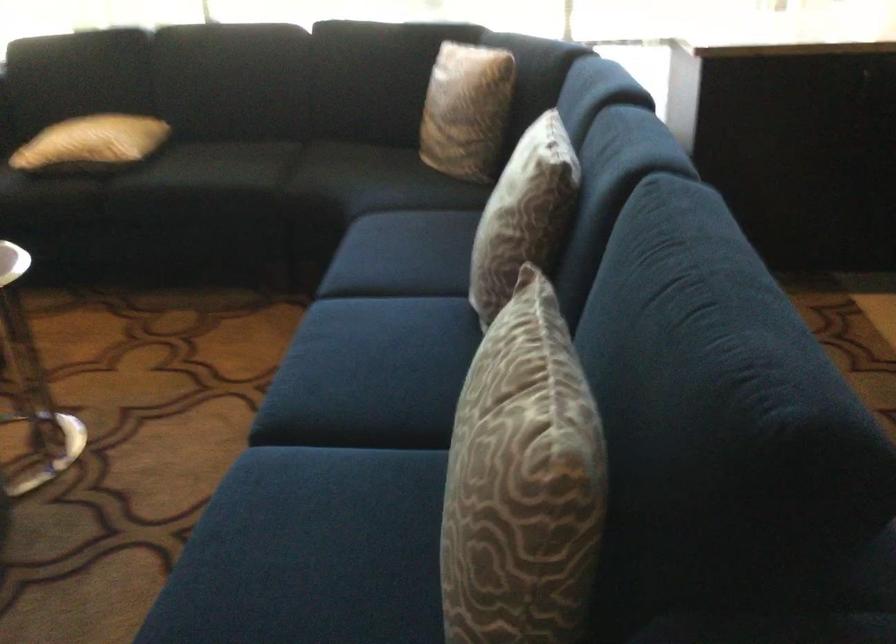
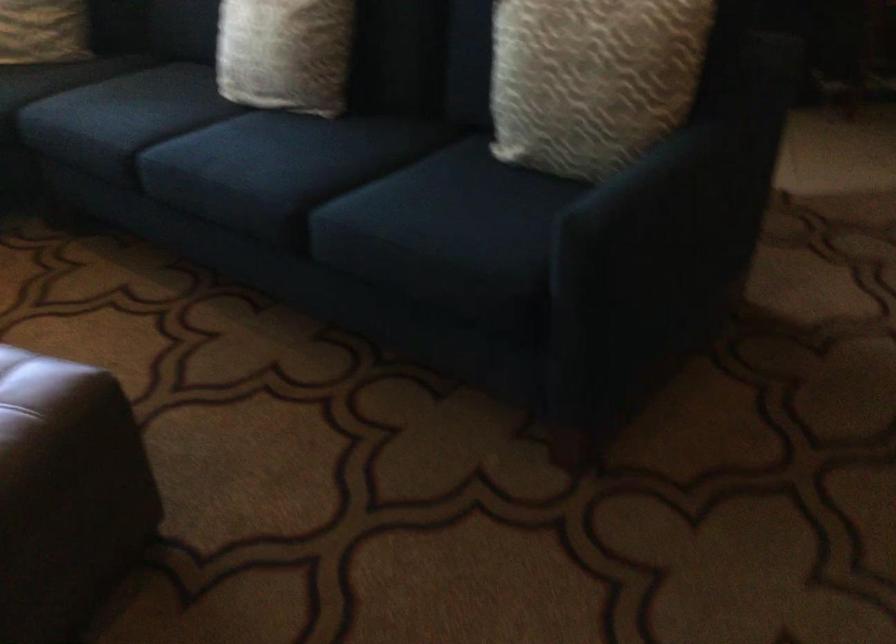
Where in the second image is the point corresponding to point (340, 351) from the first image?

(245, 154)